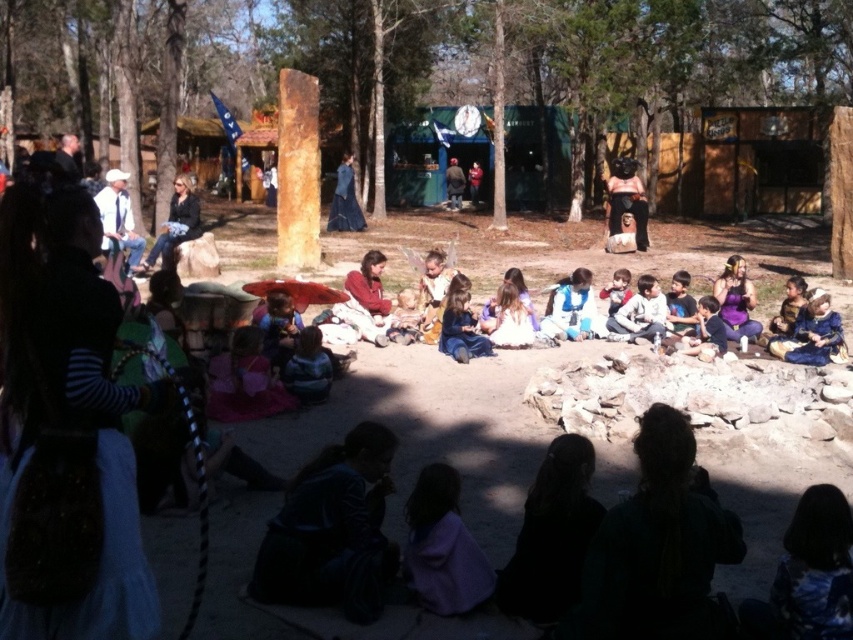
You are part of the event planning committee and need to arrange seating for the children so that the child wearing the matte blue dress at center can see the storyteller without obstruction. Since the storyteller is standing at the center, where should you position the child relative to the blue fabric dress at center?

The matte blue dress at center is to the left of blue fabric dress at center, so positioning the child wearing the matte blue dress at center to the left side of the blue fabric dress at center will ensure they can see the storyteller at the center without obstruction.

You are a photographer trying to capture the main performer in the scene. The main performer is wearing a matte blue dress at center. Given that the camera is focused on the point at coordinates point [345,200], can you confirm if the camera is correctly aimed at the main performer?

Yes, the camera is correctly aimed at the main performer because the point [345,200] corresponds to the matte blue dress at center, which is the main performer.

You are a photographer at the event and want to capture a closeup of the matte blue dress at center. According to the coordinates provided, where should you aim your camera?

The matte blue dress at center is located at coordinates point (345, 200), so you should aim your camera there.